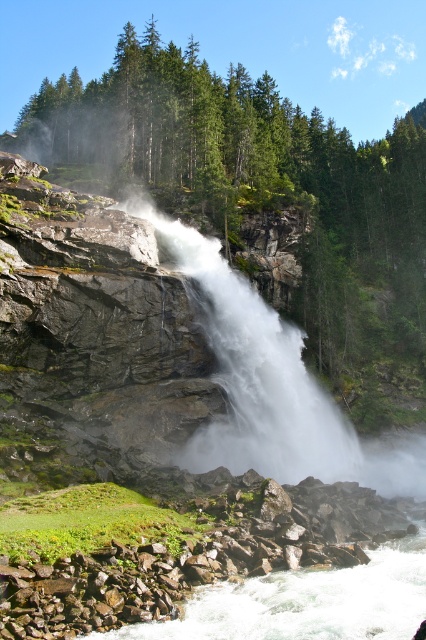
Question: Is green matte tree at center bigger than white frothy water at lower center?

Choices:
 (A) no
 (B) yes

Answer: (B)

Question: Does green matte tree at center appear on the left side of white frothy water at lower center?

Choices:
 (A) yes
 (B) no

Answer: (B)

Question: Does green matte tree at center have a smaller size compared to white frothy water at lower center?

Choices:
 (A) no
 (B) yes

Answer: (A)

Question: Among these points, which one is farthest from the camera?

Choices:
 (A) (385, 634)
 (B) (147, 163)

Answer: (B)